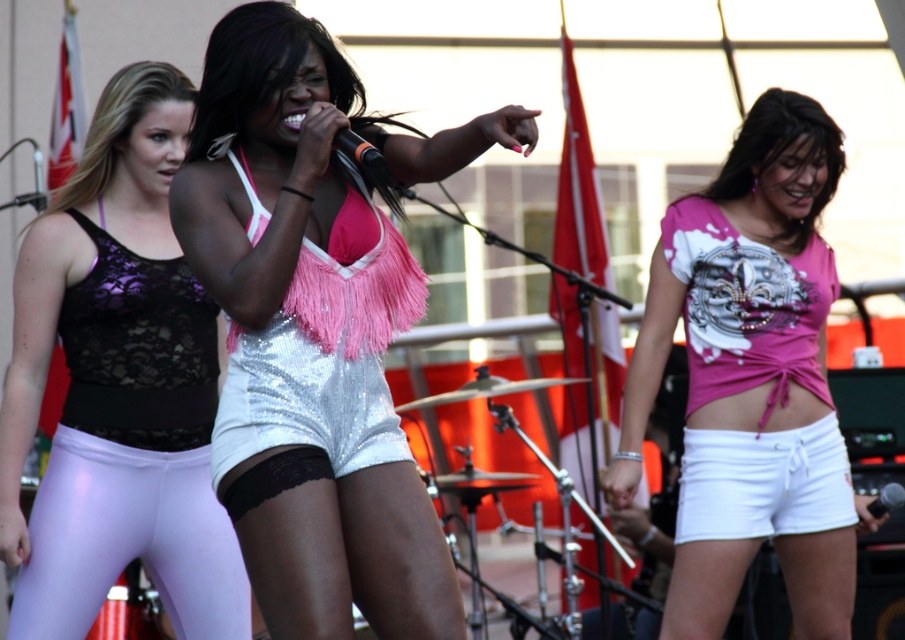
You are a costume designer preparing for a performance. You have two costume pieces to place in storage. The shiny purple leggings at left and the white lace shorts at lower right. Given their sizes, which one requires more space horizontally?

The shiny purple leggings at left requires more horizontal space because its width is larger than the white lace shorts at lower right.

You are a photographer at the event and want to capture both the sequined silver shorts at center and the white lace shorts at lower right in a single frame. Which pair of shorts should you focus on to ensure they are both visible clearly?

The sequined silver shorts at center is larger in size than the white lace shorts at lower right, so focusing on the sequined silver shorts at center will ensure both are visible clearly as the larger one will be more prominent and the smaller one can still be captured in the frame.